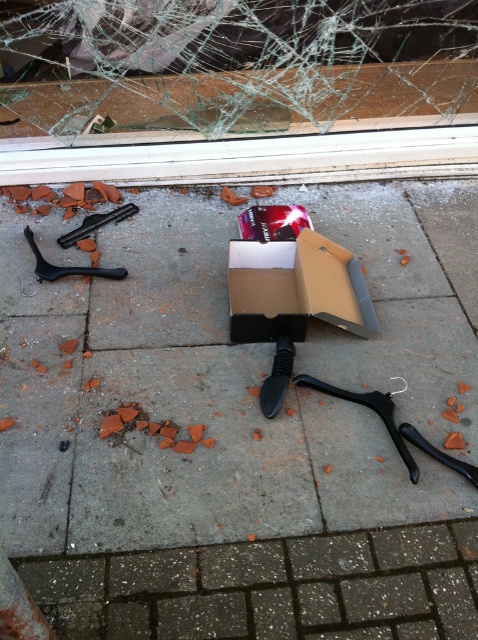
Question: Considering the real-world distances, which object is farthest from the matte cardboard box at center?

Choices:
 (A) brown cardboard box at center
 (B) black plastic hanger at left

Answer: (B)

Question: Can you confirm if matte cardboard box at center is positioned above black plastic hanger at left?

Choices:
 (A) no
 (B) yes

Answer: (A)

Question: Can you confirm if transparent glass windshield at upper center is thinner than brown cardboard box at center?

Choices:
 (A) no
 (B) yes

Answer: (A)

Question: Can you confirm if matte cardboard box at center is positioned below brown cardboard box at center?

Choices:
 (A) no
 (B) yes

Answer: (B)

Question: Which object is closer to the camera taking this photo?

Choices:
 (A) brown cardboard box at center
 (B) matte cardboard box at center
 (C) black plastic hanger at left

Answer: (B)

Question: Which object appears closest to the camera in this image?

Choices:
 (A) transparent glass windshield at upper center
 (B) black plastic tool at left

Answer: (A)